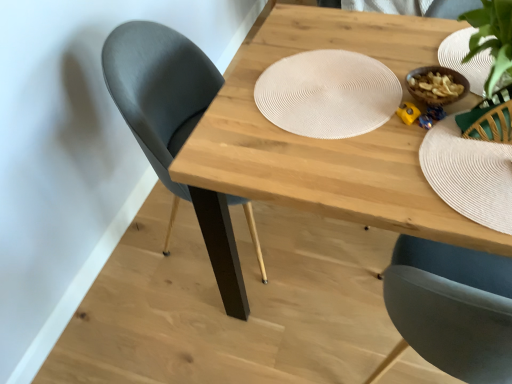
Identify the location of free space in front of white woven placemat at center. (332, 175).